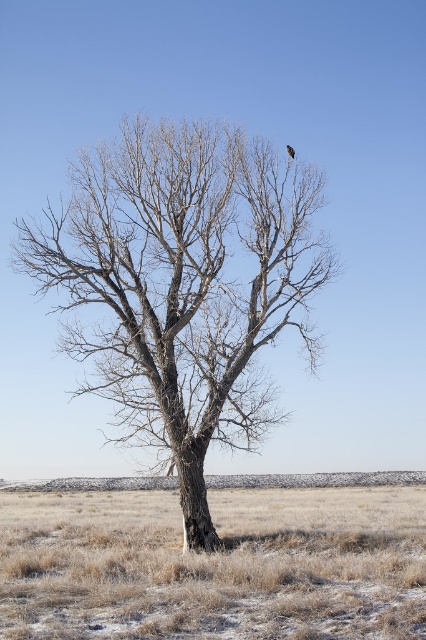
You are a hiker trying to navigate through the dry grass at lower center and the brown feathered bird at center. Which object is larger in size?

The dry grass at lower center is bigger than the brown feathered bird at center.

You are standing at the point with coordinates (181, 285) in the image. What object are you directly at?

You are directly at the brown bark tree at center located at point (181, 285).

You are standing at the base of the solitary tree in the image. You notice two points marked in the scene. Which point, point (411, 634) or point (288, 148), is closer to you?

Point (411, 634) is closer to you because it is in front of point (288, 148).